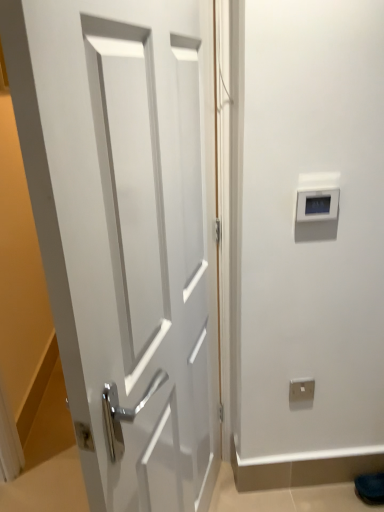
Question: Could white plastic electric outlet at lower center be considered to be inside gray plastic thermostat at upper right?

Choices:
 (A) no
 (B) yes

Answer: (A)

Question: From the image's perspective, would you say gray plastic thermostat at upper right is shown under white plastic electric outlet at lower center?

Choices:
 (A) no
 (B) yes

Answer: (A)

Question: Is gray plastic thermostat at upper right not inside white plastic electric outlet at lower center?

Choices:
 (A) yes
 (B) no

Answer: (A)

Question: Can you confirm if gray plastic thermostat at upper right is smaller than white plastic electric outlet at lower center?

Choices:
 (A) no
 (B) yes

Answer: (A)

Question: Considering the relative positions of gray plastic thermostat at upper right and white plastic electric outlet at lower center in the image provided, is gray plastic thermostat at upper right in front of white plastic electric outlet at lower center?

Choices:
 (A) yes
 (B) no

Answer: (A)

Question: Can you confirm if gray plastic thermostat at upper right is positioned to the left of white plastic electric outlet at lower center?

Choices:
 (A) no
 (B) yes

Answer: (B)

Question: Does white plastic electric outlet at lower center have a greater height compared to white glossy door at center?

Choices:
 (A) no
 (B) yes

Answer: (A)

Question: Can you confirm if white plastic electric outlet at lower center is smaller than white glossy door at center?

Choices:
 (A) yes
 (B) no

Answer: (A)

Question: From the image's perspective, is white plastic electric outlet at lower center located above white glossy door at center?

Choices:
 (A) yes
 (B) no

Answer: (B)

Question: Is white plastic electric outlet at lower center shorter than white glossy door at center?

Choices:
 (A) yes
 (B) no

Answer: (A)

Question: Is white plastic electric outlet at lower center completely or partially outside of white glossy door at center?

Choices:
 (A) no
 (B) yes

Answer: (B)

Question: From a real-world perspective, is white plastic electric outlet at lower center on top of white glossy door at center?

Choices:
 (A) no
 (B) yes

Answer: (A)

Question: Is white glossy door at center closer to camera compared to white plastic electric outlet at lower center?

Choices:
 (A) no
 (B) yes

Answer: (B)